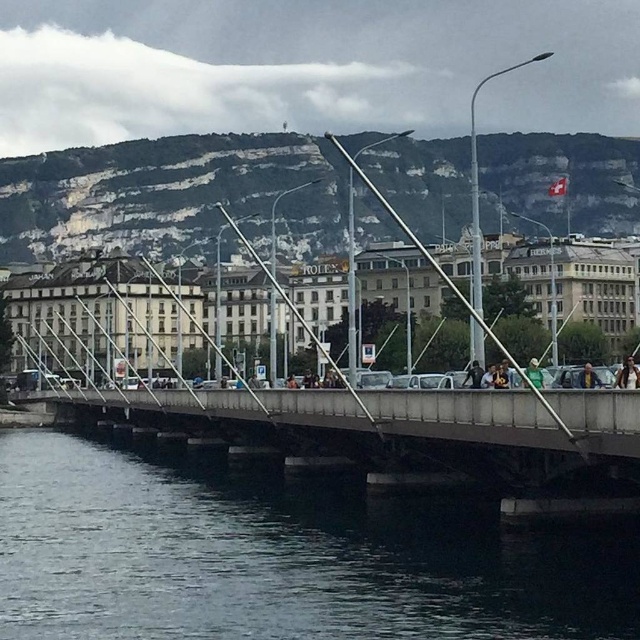
Who is higher up, dark brown leather jacket at center or light brown leather jacket at center?

dark brown leather jacket at center is above.

Is dark brown leather jacket at center positioned at the back of light brown leather jacket at center?

No, it is in front of light brown leather jacket at center.

The height and width of the screenshot is (640, 640). What do you see at coordinates (627, 374) in the screenshot?
I see `dark brown leather jacket at center` at bounding box center [627, 374].

In order to click on dark brown leather jacket at center in this screenshot , I will do `click(627, 374)`.

What do you see at coordinates (278, 557) in the screenshot?
I see `dark blue water at lower left` at bounding box center [278, 557].

Is dark blue water at lower left taller than light brown leather jacket at center?

No.

Which is behind, point (48, 586) or point (596, 378)?

The point (596, 378) is more distant.

Where is `dark blue water at lower left`? The width and height of the screenshot is (640, 640). dark blue water at lower left is located at coordinates (278, 557).

In the scene shown: Can you confirm if dark brown leather jacket at center is bigger than green fabric at center?

Yes, dark brown leather jacket at center is bigger than green fabric at center.

Is dark brown leather jacket at center to the left of green fabric at center from the viewer's perspective?

Incorrect, dark brown leather jacket at center is not on the left side of green fabric at center.

Is point (628, 358) farther from viewer compared to point (529, 378)?

Yes.

This screenshot has width=640, height=640. Find the location of `dark brown leather jacket at center`. dark brown leather jacket at center is located at coordinates (627, 374).